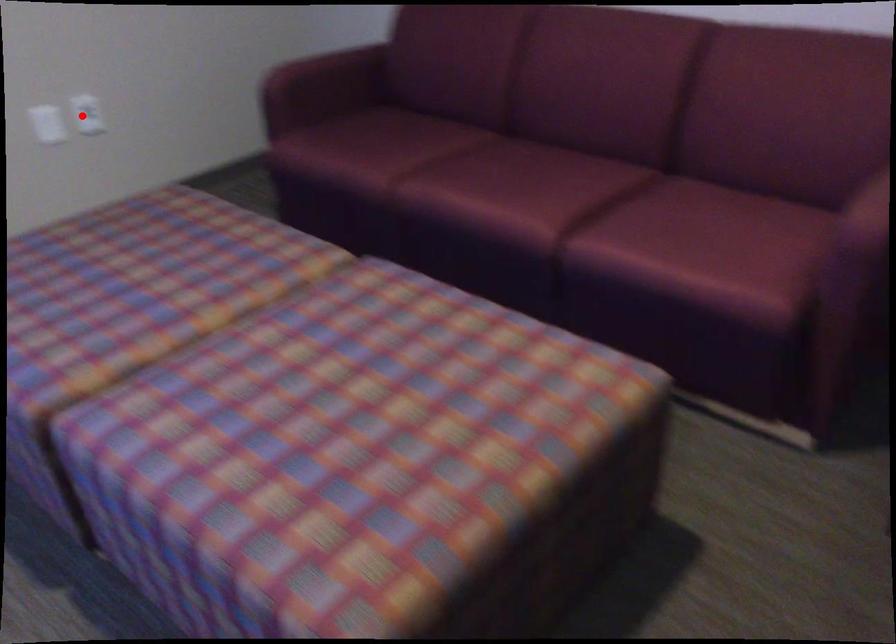
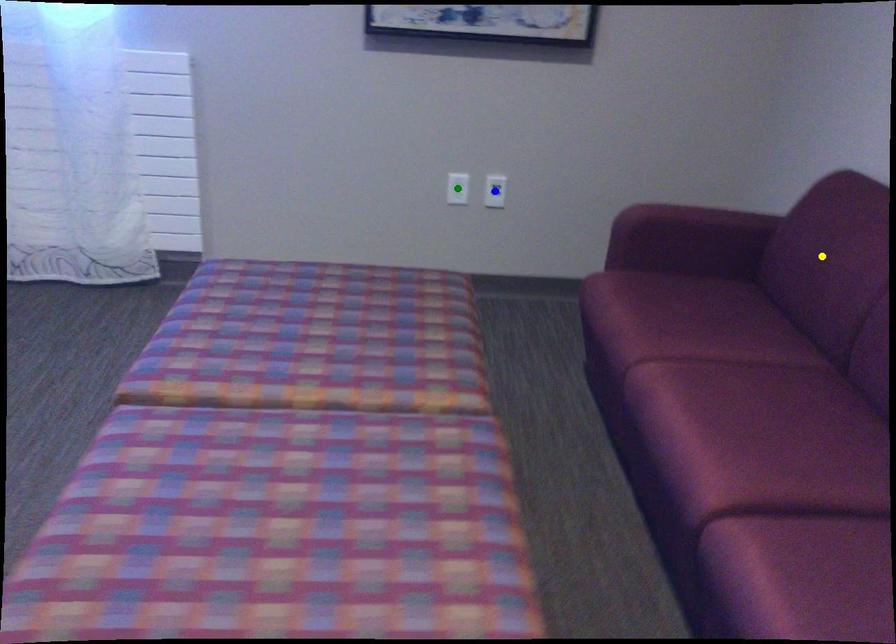
Question: I am providing you with two images of the same scene from different viewpoints. A red point is marked on the first image. You are given multiple points on the second image. Which point in image 2 is actually the same real-world point as the red point in image 1?

Choices:
 (A) yellow point
 (B) green point
 (C) blue point

Answer: (C)